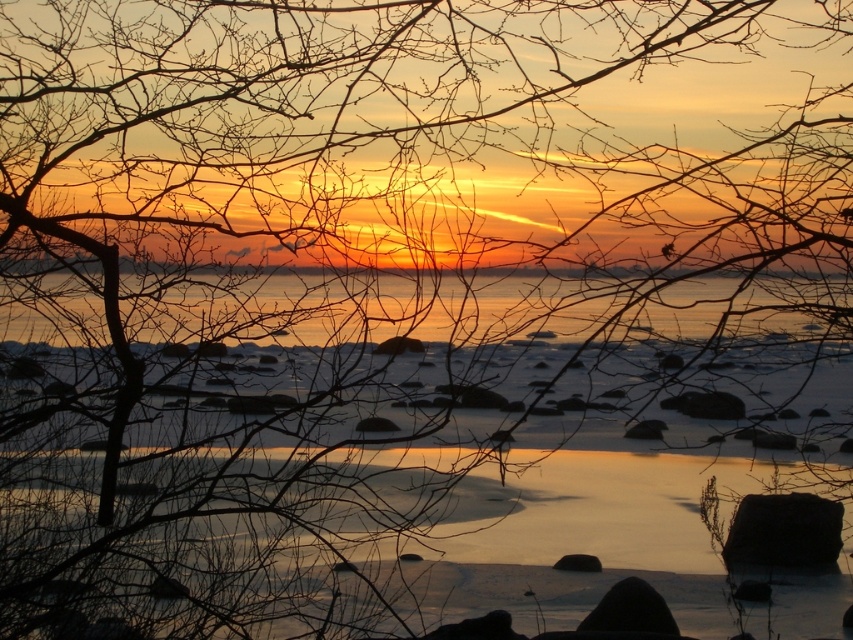
Question: Does black matte stone at lower right have a larger size compared to black smooth rock at lower center?

Choices:
 (A) yes
 (B) no

Answer: (A)

Question: Which point is farther from the camera taking this photo?

Choices:
 (A) (735, 547)
 (B) (642, 596)

Answer: (A)

Question: Does black matte stone at lower right appear over black smooth rock at lower center?

Choices:
 (A) yes
 (B) no

Answer: (A)

Question: Is black matte stone at lower right positioned in front of black smooth rock at lower center?

Choices:
 (A) no
 (B) yes

Answer: (A)